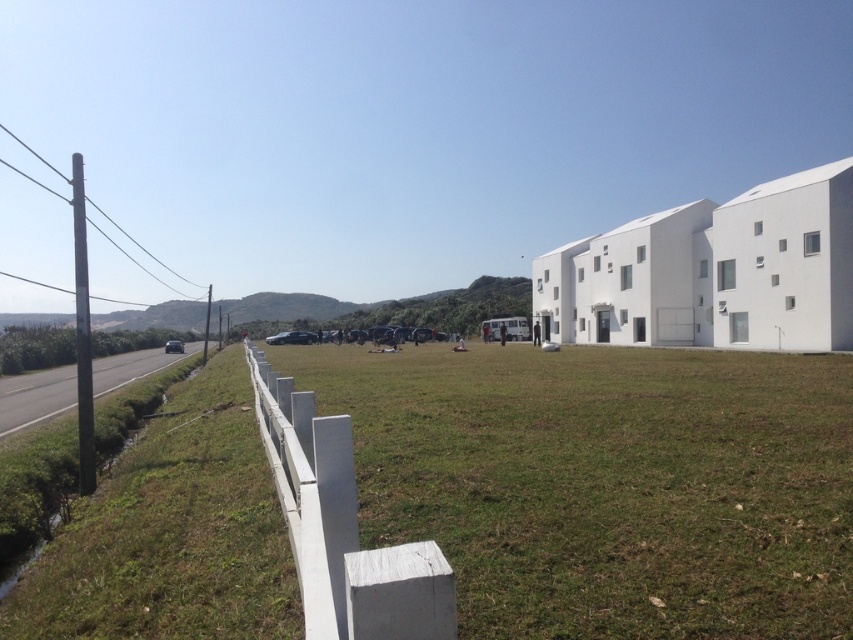
Question: Considering the relative positions of green grass at center and white painted wood fence at center in the image provided, where is green grass at center located with respect to white painted wood fence at center?

Choices:
 (A) below
 (B) above

Answer: (B)

Question: Which of the following is the farthest from the observer?

Choices:
 (A) green grass at center
 (B) white painted wood fence at center

Answer: (A)

Question: Which object appears farthest from the camera in this image?

Choices:
 (A) green grass at center
 (B) white painted wood fence at center

Answer: (A)

Question: Can you confirm if green grass at center is smaller than white painted wood fence at center?

Choices:
 (A) no
 (B) yes

Answer: (B)

Question: Which point is closer to the camera?

Choices:
 (A) (495, 554)
 (B) (297, 410)

Answer: (A)

Question: Is green grass at center further to the viewer compared to white painted wood fence at center?

Choices:
 (A) yes
 (B) no

Answer: (A)